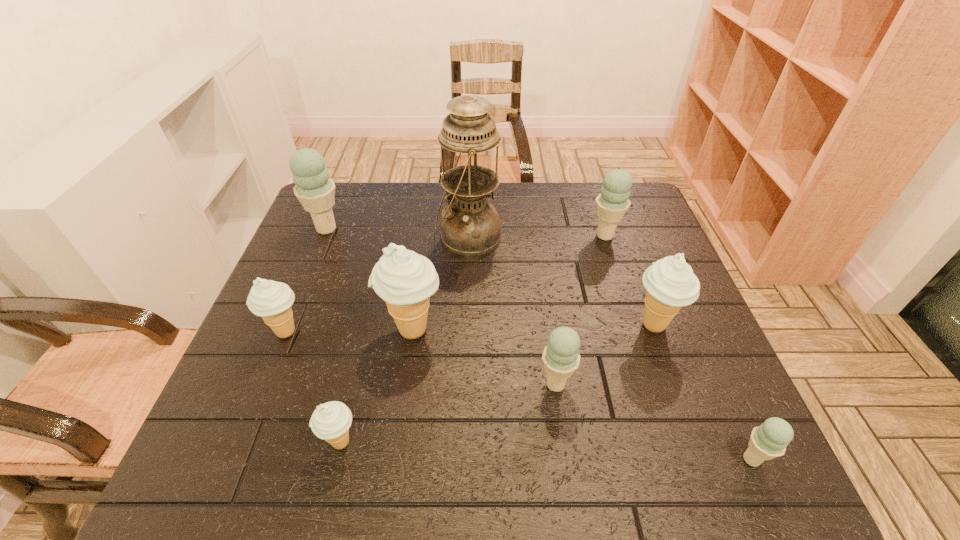
At what (x,y) coordinates should I click in order to perform the action: click on oil lamp present at the far edge. Please return your answer as a coordinate pair (x, y). Looking at the image, I should click on (470, 226).

Identify the location of object present at the far left corner. (314, 189).

Where is `object at the far right corner`? object at the far right corner is located at coordinates (612, 203).

You are a GUI agent. You are given a task and a screenshot of the screen. Output one action in this format:
    pyautogui.click(x=<x>, y=<y>)
    Task: Click on the object located at the near right corner
    This screenshot has height=540, width=960.
    Given the screenshot: What is the action you would take?
    pyautogui.click(x=769, y=440)

This screenshot has width=960, height=540. I want to click on free spot at the far edge of the desktop, so click(x=508, y=191).

Identify the location of vacant space at the near edge of the desktop. (622, 461).

In the image, there is a desktop. At what (x,y) coordinates should I click in order to perform the action: click on free region at the left edge. Please return your answer as a coordinate pair (x, y). The image size is (960, 540). Looking at the image, I should click on (300, 324).

The width and height of the screenshot is (960, 540). I want to click on free location at the right edge, so click(x=709, y=364).

In the image, there is a desktop. Where is `free region at the far left corner`? The height and width of the screenshot is (540, 960). free region at the far left corner is located at coordinates (367, 196).

In the image, there is a desktop. Identify the location of vacant area at the near left corner. The width and height of the screenshot is (960, 540). (200, 456).